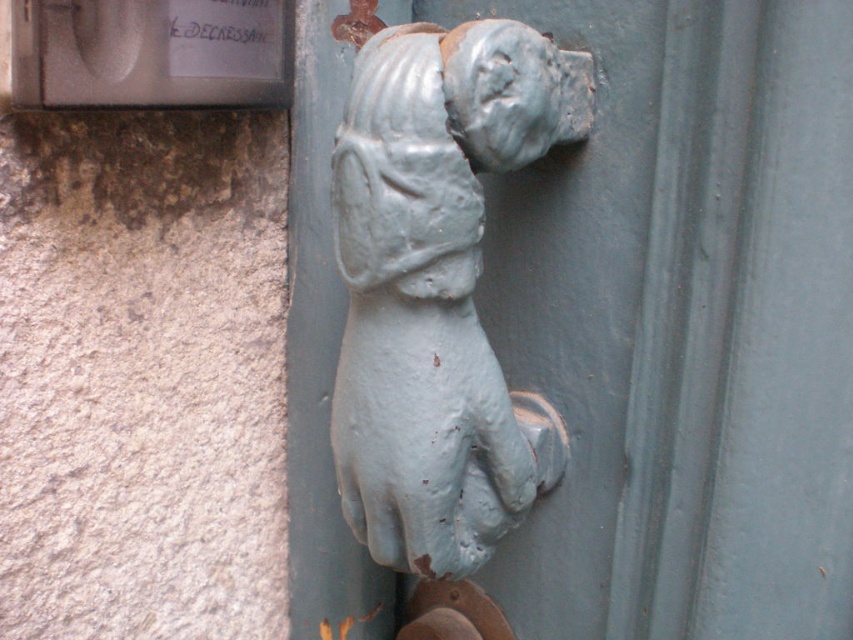
The width and height of the screenshot is (853, 640). What do you see at coordinates (434, 282) in the screenshot?
I see `light blue painted metal dog at center` at bounding box center [434, 282].

How much distance is there between light blue painted metal dog at center and rusty metal door handle at lower center?

light blue painted metal dog at center and rusty metal door handle at lower center are 5.96 inches apart.

Is point (416, 156) more distant than point (457, 612)?

No, (416, 156) is closer to viewer.

Where is `light blue painted metal dog at center`? This screenshot has height=640, width=853. light blue painted metal dog at center is located at coordinates (434, 282).

Between blue painted metal dog at center and rusty metal door handle at lower center, which one is positioned lower?

rusty metal door handle at lower center

Locate an element on the screen. blue painted metal dog at center is located at coordinates (631, 324).

Between point (761, 460) and point (463, 611), which one is positioned behind?

The point (463, 611) is more distant.

You are a GUI agent. You are given a task and a screenshot of the screen. Output one action in this format:
    pyautogui.click(x=<x>, y=<y>)
    Task: Click on the blue painted metal dog at center
    The width and height of the screenshot is (853, 640).
    Given the screenshot: What is the action you would take?
    pyautogui.click(x=631, y=324)

Can you confirm if blue painted metal dog at center is smaller than light blue painted metal dog at center?

No.

Between blue painted metal dog at center and light blue painted metal dog at center, which one is positioned higher?

blue painted metal dog at center is higher up.

Is point (567, 588) closer to camera compared to point (337, 179)?

No, (567, 588) is further to viewer.

At what (x,y) coordinates should I click in order to perform the action: click on blue painted metal dog at center. Please return your answer as a coordinate pair (x, y). Image resolution: width=853 pixels, height=640 pixels. Looking at the image, I should click on (631, 324).